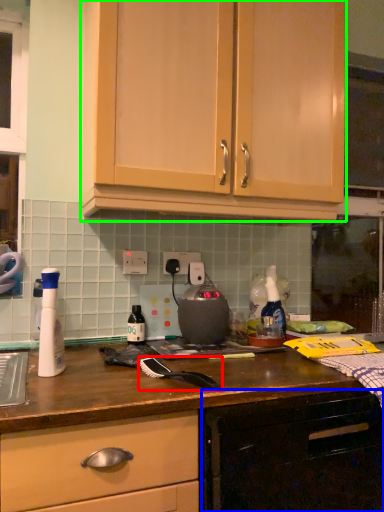
Question: Estimate the real-world distances between objects in this image. Which object is farther from brush (highlighted by a red box), cabinetry (highlighted by a blue box) or cabinetry (highlighted by a green box)?

Choices:
 (A) cabinetry
 (B) cabinetry

Answer: (B)